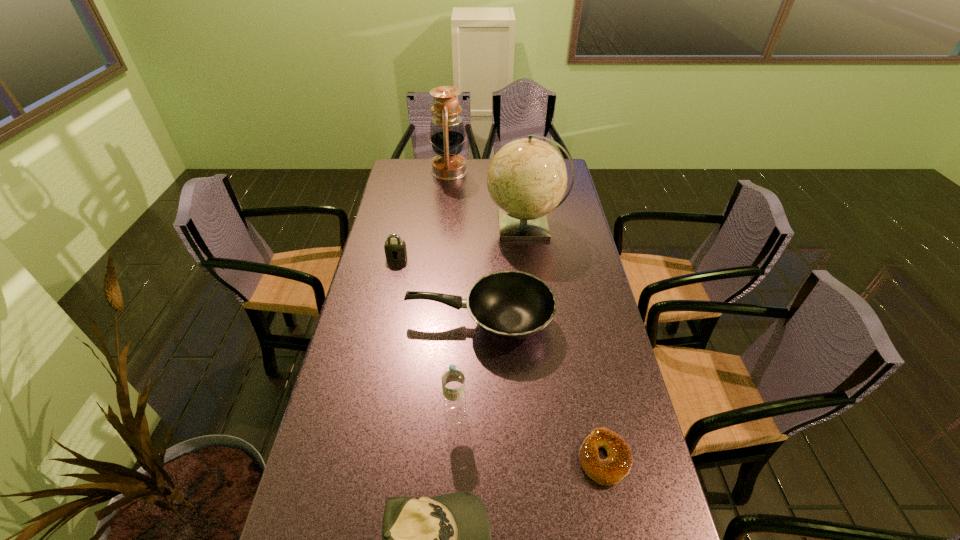
This screenshot has height=540, width=960. In order to click on bagel situated at the right edge in this screenshot , I will do `click(616, 466)`.

Identify the location of vacant area at the far edge of the desktop. Image resolution: width=960 pixels, height=540 pixels. (428, 178).

In the image, there is a desktop. Where is `free space at the left edge`? This screenshot has width=960, height=540. free space at the left edge is located at coordinates (391, 195).

This screenshot has width=960, height=540. I want to click on vacant space at the right edge of the desktop, so click(x=648, y=476).

Locate an element on the screen. The width and height of the screenshot is (960, 540). vacant space that is in between the sixth nearest object and the third farthest object is located at coordinates (462, 241).

You are a GUI agent. You are given a task and a screenshot of the screen. Output one action in this format:
    pyautogui.click(x=<x>, y=<y>)
    Task: Click on the free space between the water bottle and the frying pan
    
    Given the screenshot: What is the action you would take?
    pyautogui.click(x=468, y=368)

This screenshot has width=960, height=540. Identify the location of vacant space in between the sixth nearest object and the farthest object. (488, 198).

Select which object is the fourth closest to the fifth shortest object. Please provide its 2D coordinates. Your answer should be formatted as a tuple, i.e. [(x, y)], where the tuple contains the x and y coordinates of a point satisfying the conditions above.

[(397, 247)]

Point out which object is positioned as the fourth nearest to the fifth farthest object. Please provide its 2D coordinates. Your answer should be formatted as a tuple, i.e. [(x, y)], where the tuple contains the x and y coordinates of a point satisfying the conditions above.

[(397, 247)]

At what (x,y) coordinates should I click in order to perform the action: click on vacant region that satisfies the following two spatial constraints: 1. on the surface of the shortest object showing Europe and Africa; 2. on the right side of the second farthest object. Please return your answer as a coordinate pair (x, y). The height and width of the screenshot is (540, 960). Looking at the image, I should click on (556, 458).